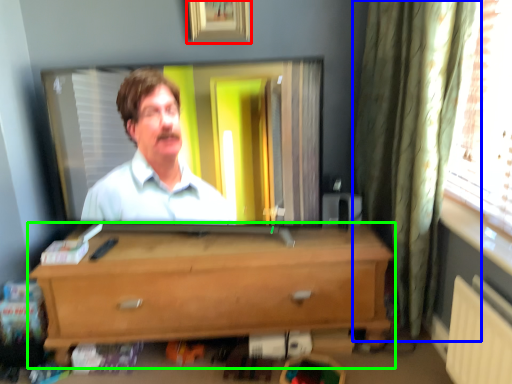
Question: Which is nearer to the picture frame (highlighted by a red box)? curtain (highlighted by a blue box) or chest of drawers (highlighted by a green box).

Choices:
 (A) curtain
 (B) chest of drawers

Answer: (A)